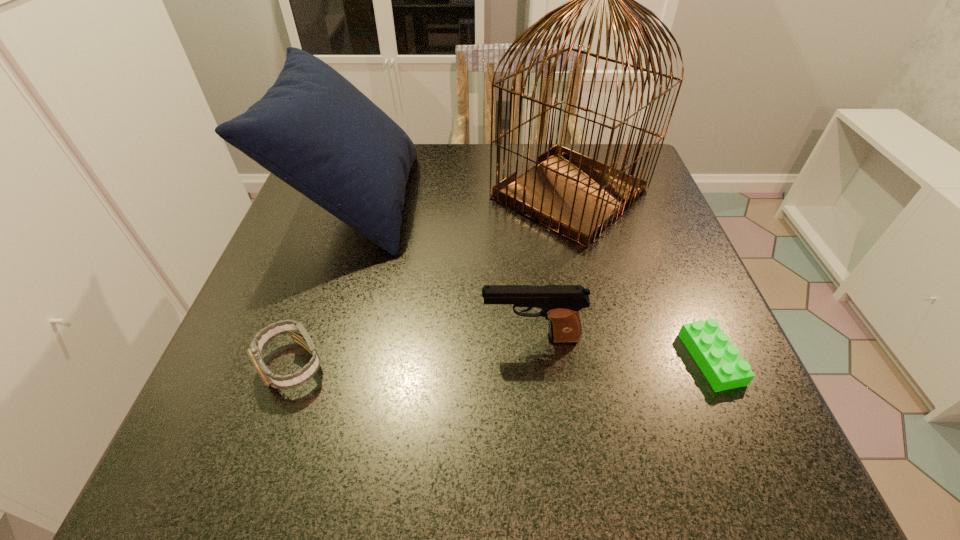
Identify the location of vacant space at the far edge. (448, 172).

This screenshot has width=960, height=540. In the image, there is a desktop. What are the coordinates of `vacant space at the near edge` in the screenshot? It's located at (455, 478).

Locate an element on the screen. free space at the left edge is located at coordinates (307, 224).

Where is `vacant area at the right edge of the desktop`? The width and height of the screenshot is (960, 540). vacant area at the right edge of the desktop is located at coordinates (650, 280).

The height and width of the screenshot is (540, 960). In order to click on free region at the near left corner of the desktop in this screenshot , I will do `click(240, 460)`.

The width and height of the screenshot is (960, 540). I want to click on empty space that is in between the third tallest object and the watch, so click(x=411, y=352).

This screenshot has width=960, height=540. Identify the location of free space between the third tallest object and the tallest object. (550, 267).

At what (x,y) coordinates should I click in order to perform the action: click on unoccupied area between the birdcage and the shortest object. Please return your answer as a coordinate pair (x, y). This screenshot has height=540, width=960. Looking at the image, I should click on (x=640, y=277).

This screenshot has height=540, width=960. What are the coordinates of `blank region between the pistol and the tallest object` in the screenshot? It's located at (550, 267).

Where is `free space between the shortest object and the cushion`? The height and width of the screenshot is (540, 960). free space between the shortest object and the cushion is located at coordinates (533, 280).